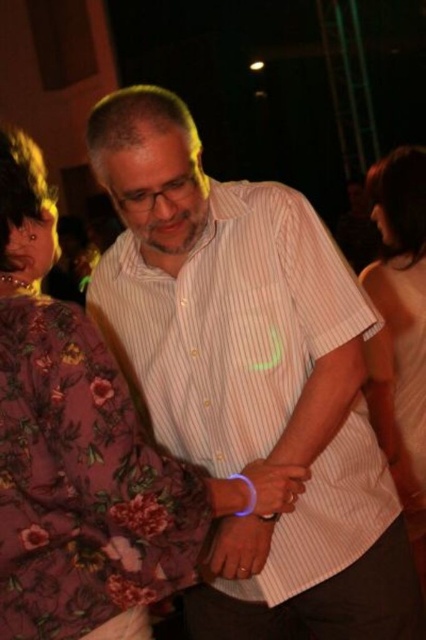
In order to click on white striped shirt at center in this screenshot , I will do `click(250, 378)`.

Is white striped shirt at center wider than white matte tank top at upper right?

Yes, white striped shirt at center is wider than white matte tank top at upper right.

Where is `white striped shirt at center`? The image size is (426, 640). white striped shirt at center is located at coordinates (250, 378).